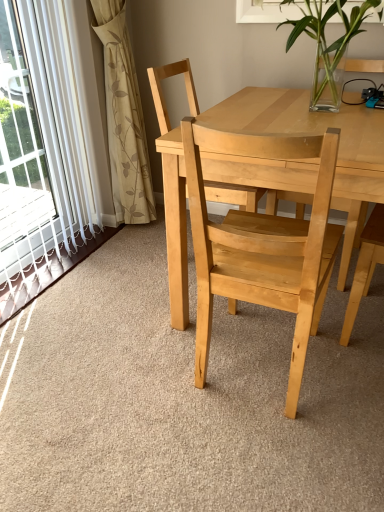
Where is `free space to the left of natural wood chair at center, placed as the first chair when sorted from front to back`? free space to the left of natural wood chair at center, placed as the first chair when sorted from front to back is located at coordinates (137, 369).